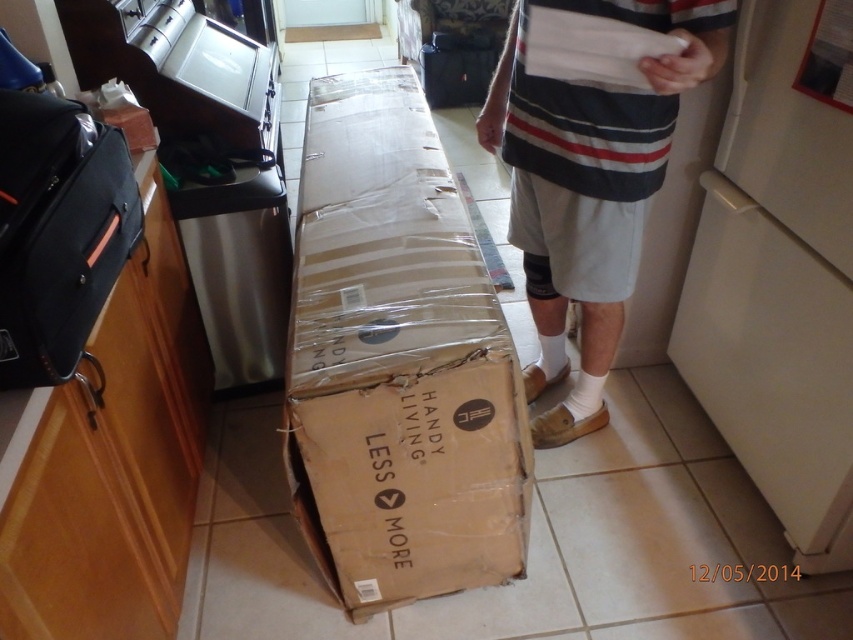
You are a delivery person who just arrived at the house. You see the brown cardboard box at center and the white striped shorts at center. Which object is closer to you?

The brown cardboard box at center is closer to you because it is further to the viewer than the white striped shorts at center.

You are helping someone move into a new apartment and see the brown cardboard box at center and the white striped shorts at center. Which object is positioned lower in the scene?

The brown cardboard box at center is located below the white striped shorts at center, so it is positioned lower in the scene.